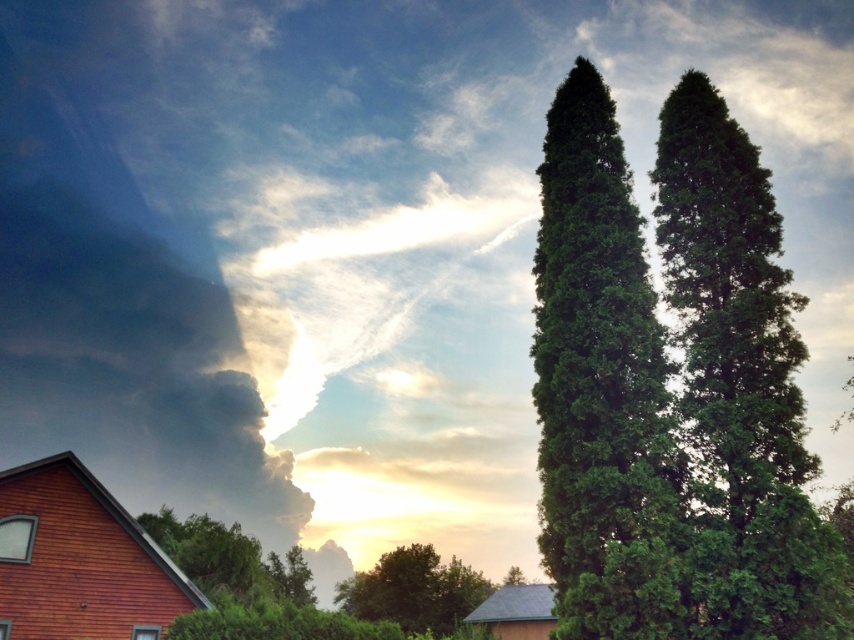
Question: In this image, where is green textured cypress at right located relative to green leafy tree at lower left?

Choices:
 (A) above
 (B) below

Answer: (A)

Question: Which is nearer to the green leafy cypress at right?

Choices:
 (A) green leafy tree at center
 (B) green textured cypress at right

Answer: (B)

Question: In this image, where is green leafy cypress at right located relative to green leafy tree at lower left?

Choices:
 (A) left
 (B) right

Answer: (B)

Question: Which point is farther from the camera taking this photo?

Choices:
 (A) (x=793, y=444)
 (B) (x=226, y=547)
 (C) (x=379, y=595)
 (D) (x=539, y=417)

Answer: (C)

Question: Which object appears closest to the camera in this image?

Choices:
 (A) green textured cypress at right
 (B) green leafy tree at center

Answer: (A)

Question: Does green leafy tree at lower left have a lesser width compared to green leafy tree at center?

Choices:
 (A) no
 (B) yes

Answer: (A)